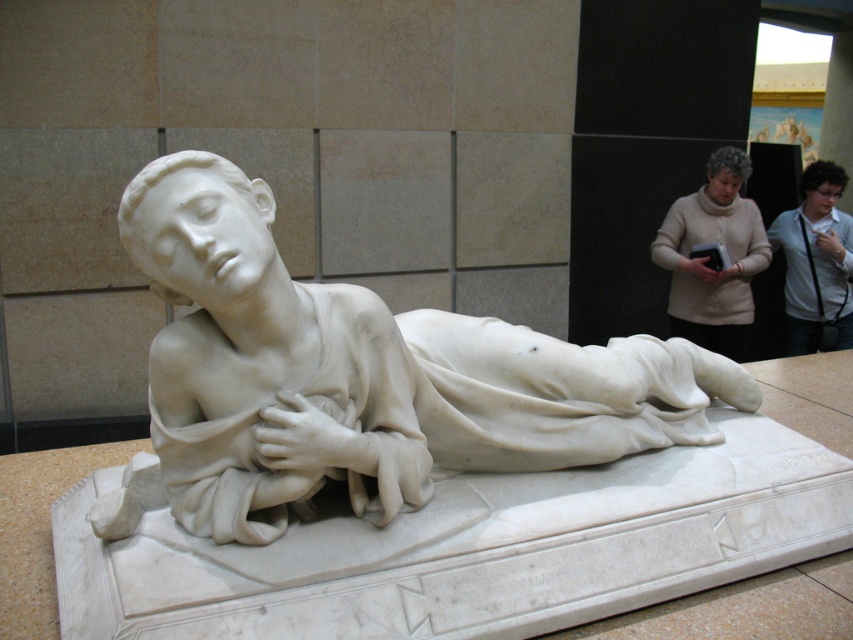
You are an art student standing in front of the white marble statue at center and the beige sweater at upper right. You want to sketch the statue first. Which object should you focus on first based on their positions?

You should focus on the white marble statue at center first because it is closer to you than the beige sweater at upper right, making it easier to capture its details.